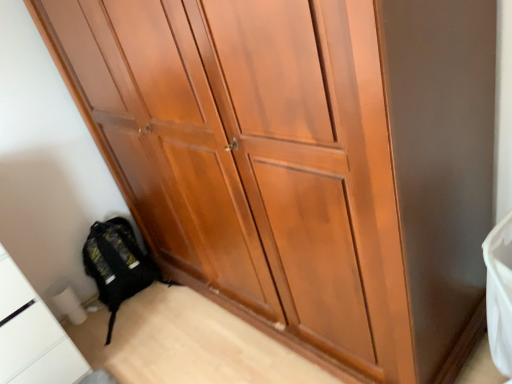
Measure the distance between white glossy cabinet at lower left and camera.

white glossy cabinet at lower left and camera are 5.08 feet apart.

The height and width of the screenshot is (384, 512). Find the location of `white glossy cabinet at lower left`. white glossy cabinet at lower left is located at coordinates (32, 335).

This screenshot has height=384, width=512. Describe the element at coordinates (32, 335) in the screenshot. I see `white glossy cabinet at lower left` at that location.

The height and width of the screenshot is (384, 512). What do you see at coordinates (118, 265) in the screenshot?
I see `black fabric backpack at lower left` at bounding box center [118, 265].

In order to click on black fabric backpack at lower left in this screenshot , I will do `click(118, 265)`.

Measure the distance between black fabric backpack at lower left and camera.

black fabric backpack at lower left is 2.08 meters away from camera.

You are a GUI agent. You are given a task and a screenshot of the screen. Output one action in this format:
    pyautogui.click(x=<x>, y=<y>)
    Task: Click on the white glossy cabinet at lower left
    The height and width of the screenshot is (384, 512).
    Given the screenshot: What is the action you would take?
    pyautogui.click(x=32, y=335)

Does black fabric backpack at lower left appear on the left side of white glossy cabinet at lower left?

No, black fabric backpack at lower left is not to the left of white glossy cabinet at lower left.

Considering the relative positions of black fabric backpack at lower left and white glossy cabinet at lower left in the image provided, is black fabric backpack at lower left behind white glossy cabinet at lower left?

Yes, black fabric backpack at lower left is further from the viewer.

Is point (116, 220) farther from camera compared to point (81, 375)?

Yes, point (116, 220) is behind point (81, 375).

From the image's perspective, is black fabric backpack at lower left located beneath white glossy cabinet at lower left?

No, from the image's perspective, black fabric backpack at lower left is not beneath white glossy cabinet at lower left.

From a real-world perspective, is black fabric backpack at lower left over white glossy cabinet at lower left?

No, from a real-world perspective, black fabric backpack at lower left is not over white glossy cabinet at lower left

Which object is thinner, black fabric backpack at lower left or white glossy cabinet at lower left?

Thinner between the two is black fabric backpack at lower left.

In terms of height, does black fabric backpack at lower left look taller or shorter compared to white glossy cabinet at lower left?

Considering their sizes, black fabric backpack at lower left has less height than white glossy cabinet at lower left.

From the picture: Considering the relative sizes of black fabric backpack at lower left and white glossy cabinet at lower left in the image provided, is black fabric backpack at lower left bigger than white glossy cabinet at lower left?

No, black fabric backpack at lower left is not bigger than white glossy cabinet at lower left.

Is black fabric backpack at lower left not inside white glossy cabinet at lower left?

Indeed, black fabric backpack at lower left is completely outside white glossy cabinet at lower left.

Are black fabric backpack at lower left and white glossy cabinet at lower left beside each other?

No, black fabric backpack at lower left is not next to white glossy cabinet at lower left.

Is black fabric backpack at lower left turned away from white glossy cabinet at lower left?

black fabric backpack at lower left is not turned away from white glossy cabinet at lower left.

Locate an element on the screen. The image size is (512, 384). cabinetry that appears on the left of black fabric backpack at lower left is located at coordinates (32, 335).

Based on the photo, can you confirm if white glossy cabinet at lower left is positioned to the left of black fabric backpack at lower left?

Yes.

Is white glossy cabinet at lower left closer to the viewer compared to black fabric backpack at lower left?

Yes, white glossy cabinet at lower left is in front of black fabric backpack at lower left.

Which is more distant, (0, 257) or (118, 224)?

The point (118, 224) is farther.

From the image's perspective, is white glossy cabinet at lower left above or below black fabric backpack at lower left?

Based on their image positions, white glossy cabinet at lower left is located beneath black fabric backpack at lower left.

From a real-world perspective, who is located lower, white glossy cabinet at lower left or black fabric backpack at lower left?

black fabric backpack at lower left is physically lower.

From the picture: Does white glossy cabinet at lower left have a greater width compared to black fabric backpack at lower left?

Indeed, white glossy cabinet at lower left has a greater width compared to black fabric backpack at lower left.

In the scene shown: Considering the relative sizes of white glossy cabinet at lower left and black fabric backpack at lower left in the image provided, is white glossy cabinet at lower left shorter than black fabric backpack at lower left?

No, white glossy cabinet at lower left is not shorter than black fabric backpack at lower left.

Based on their sizes in the image, would you say white glossy cabinet at lower left is bigger or smaller than black fabric backpack at lower left?

Considering their sizes, white glossy cabinet at lower left takes up more space than black fabric backpack at lower left.

Is white glossy cabinet at lower left spatially inside black fabric backpack at lower left, or outside of it?

white glossy cabinet at lower left is not enclosed by black fabric backpack at lower left.

Is white glossy cabinet at lower left directly adjacent to black fabric backpack at lower left?

No.

Is black fabric backpack at lower left at the back of white glossy cabinet at lower left?

No, white glossy cabinet at lower left's orientation is not away from black fabric backpack at lower left.

Find the location of a particular element. cabinetry on the left of black fabric backpack at lower left is located at coordinates (32, 335).

You are a GUI agent. You are given a task and a screenshot of the screen. Output one action in this format:
    pyautogui.click(x=<x>, y=<y>)
    Task: Click on the cabinetry that appears on the left of black fabric backpack at lower left
    Image resolution: width=512 pixels, height=384 pixels.
    Given the screenshot: What is the action you would take?
    pyautogui.click(x=32, y=335)

Where is `backpack on the right of white glossy cabinet at lower left`? Image resolution: width=512 pixels, height=384 pixels. backpack on the right of white glossy cabinet at lower left is located at coordinates (118, 265).